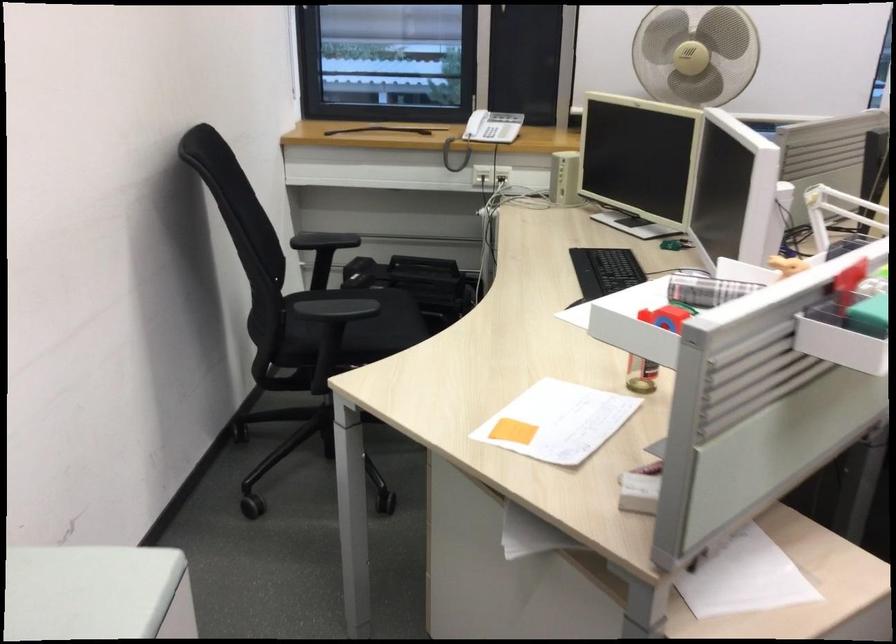
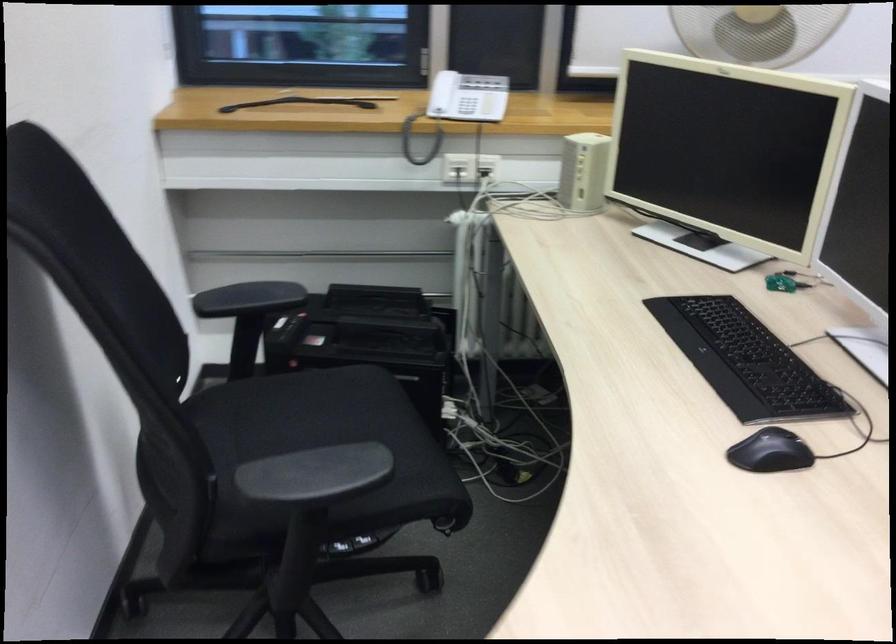
Question: The camera is either moving clockwise (left) or counter-clockwise (right) around the object. The first image is from the beginning of the video and the second image is from the end. Is the camera moving left or right when shooting the video?

Choices:
 (A) Left
 (B) Right

Answer: (A)